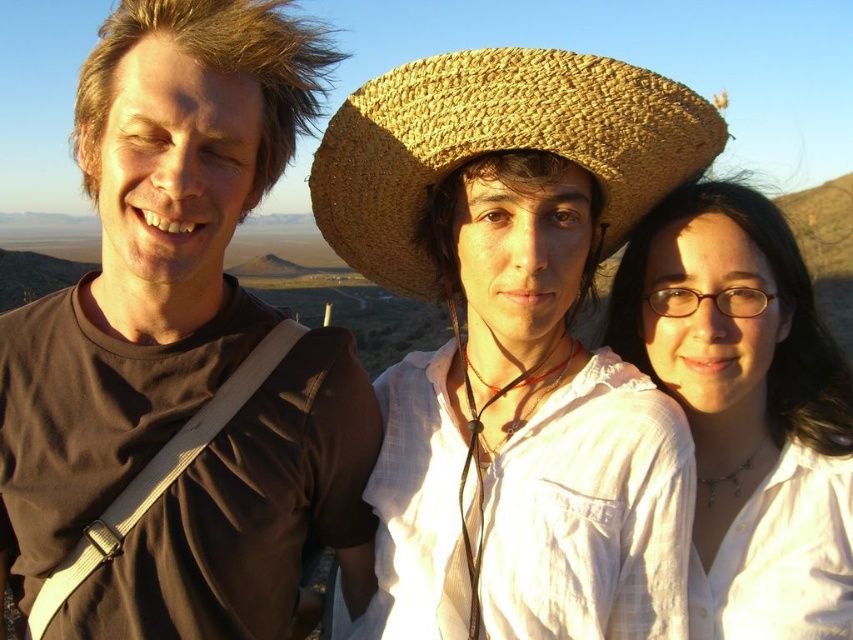
Who is shorter, brown matte shirt at left or white matte shirt at center?

white matte shirt at center is shorter.

Is brown matte shirt at left shorter than white matte shirt at center?

In fact, brown matte shirt at left may be taller than white matte shirt at center.

Between point (286, 545) and point (659, 381), which one is positioned behind?

Positioned behind is point (659, 381).

This screenshot has width=853, height=640. I want to click on brown matte shirt at left, so click(181, 348).

Is white matte shirt at center positioned in front of woven straw cowboy hat at center?

No.

The width and height of the screenshot is (853, 640). What do you see at coordinates (746, 410) in the screenshot? I see `white matte shirt at center` at bounding box center [746, 410].

The height and width of the screenshot is (640, 853). Find the location of `white matte shirt at center`. white matte shirt at center is located at coordinates (746, 410).

Between natural straw hat at center and brown matte shirt at left, which one is positioned lower?

natural straw hat at center is lower down.

Image resolution: width=853 pixels, height=640 pixels. What do you see at coordinates (517, 339) in the screenshot?
I see `natural straw hat at center` at bounding box center [517, 339].

Between point (650, 136) and point (152, 428), which one is positioned behind?

Positioned behind is point (152, 428).

This screenshot has width=853, height=640. I want to click on natural straw hat at center, so click(517, 339).